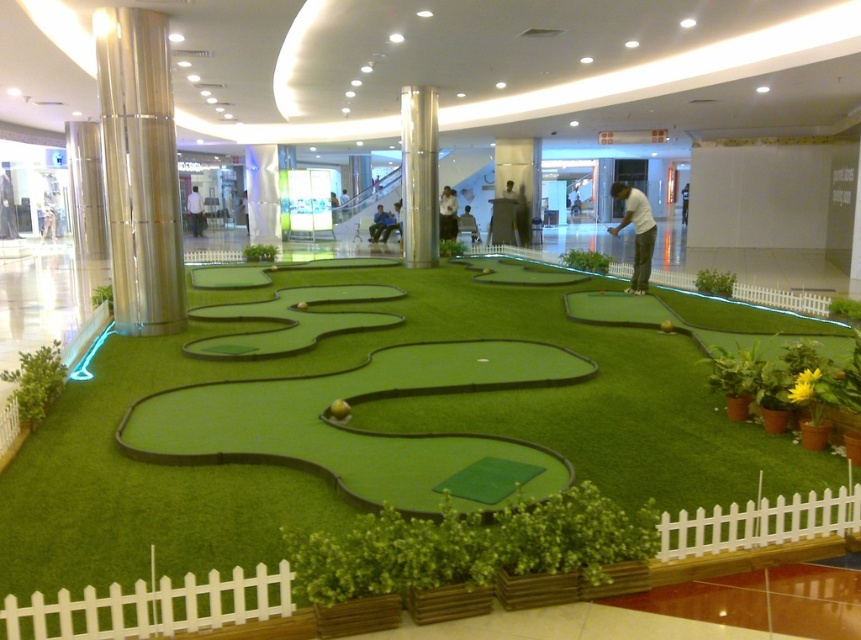
Is metallic silver pillar at center shorter than white matte golf club at center?

Indeed, metallic silver pillar at center has a lesser height compared to white matte golf club at center.

Which is in front, point (418, 227) or point (645, 266)?

Point (645, 266) is more forward.

Does point (407, 228) come behind point (649, 237)?

Yes, point (407, 228) is behind point (649, 237).

Identify the location of metallic silver pillar at center. (418, 176).

Which of these two, silver metallic pillar at left or metallic silver pillar at center, stands taller?

metallic silver pillar at center

Does point (137, 122) come farther from viewer compared to point (425, 131)?

No.

Between point (137, 48) and point (414, 257), which one is positioned behind?

The point (414, 257) is behind.

Identify the location of silver metallic pillar at left. The height and width of the screenshot is (640, 861). (139, 170).

Who is more forward, (x=125, y=115) or (x=632, y=205)?

Point (x=125, y=115) is in front.

The image size is (861, 640). Describe the element at coordinates (139, 170) in the screenshot. I see `silver metallic pillar at left` at that location.

Image resolution: width=861 pixels, height=640 pixels. Identify the location of silver metallic pillar at left. (139, 170).